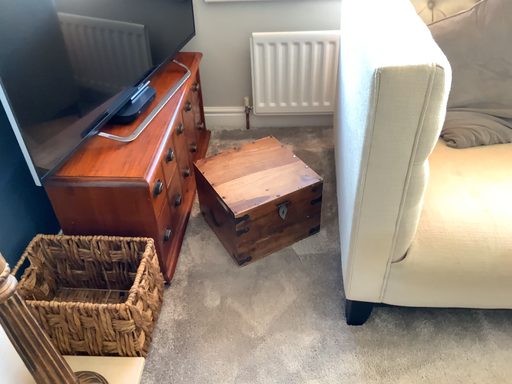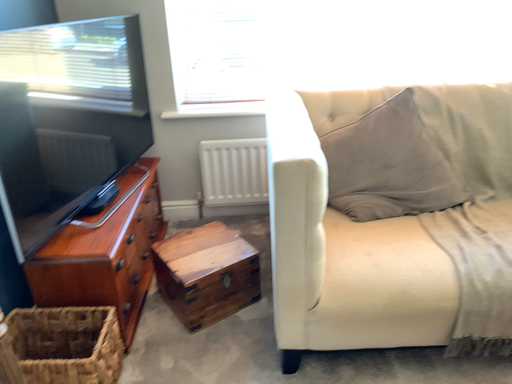
Question: Which way did the camera rotate in the video?

Choices:
 (A) rotated downward
 (B) rotated upward

Answer: (B)